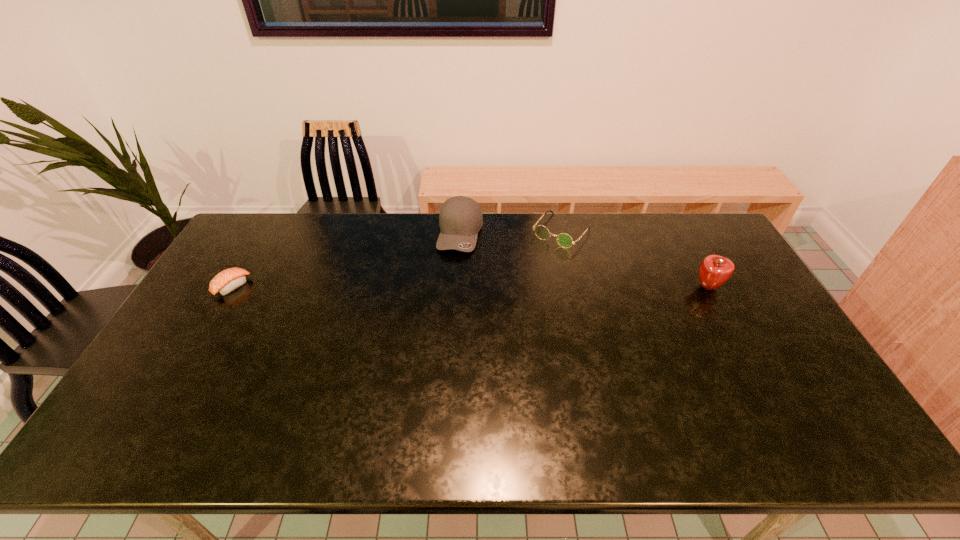
Image resolution: width=960 pixels, height=540 pixels. In order to click on free space between the third object from left to right and the second object from left to right in this screenshot , I will do `click(511, 232)`.

I want to click on vacant space in between the second object from left to right and the leftmost object, so click(347, 260).

I want to click on free space between the third object from right to left and the apple, so click(x=585, y=260).

Locate an element on the screen. free spot between the leftmost object and the baseball cap is located at coordinates (347, 260).

Find the location of `object that is the third closest one to the apple`. object that is the third closest one to the apple is located at coordinates (230, 279).

The height and width of the screenshot is (540, 960). Find the location of `object that stands as the third closest to the baseball cap`. object that stands as the third closest to the baseball cap is located at coordinates (715, 270).

What are the coordinates of `free space that satisfies the following two spatial constraints: 1. on the back side of the third object from right to left; 2. on the right side of the spectacles` in the screenshot? It's located at (461, 231).

Locate an element on the screen. This screenshot has width=960, height=540. vacant space that satisfies the following two spatial constraints: 1. on the back side of the baseball cap; 2. on the left side of the spectacles is located at coordinates (461, 231).

You are a GUI agent. You are given a task and a screenshot of the screen. Output one action in this format:
    pyautogui.click(x=<x>, y=<y>)
    Task: Click on the vacant space that satisfies the following two spatial constraints: 1. on the back side of the third tallest object; 2. on the right side of the third object from right to left
    
    Given the screenshot: What is the action you would take?
    pyautogui.click(x=461, y=231)